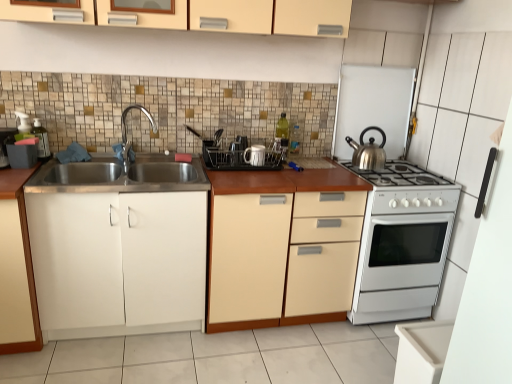
Find the location of a particular element. The height and width of the screenshot is (384, 512). vacant region to the right of clear plastic utensil rack at center, which ranks as the 2th appliance in left-to-right order is located at coordinates (274, 172).